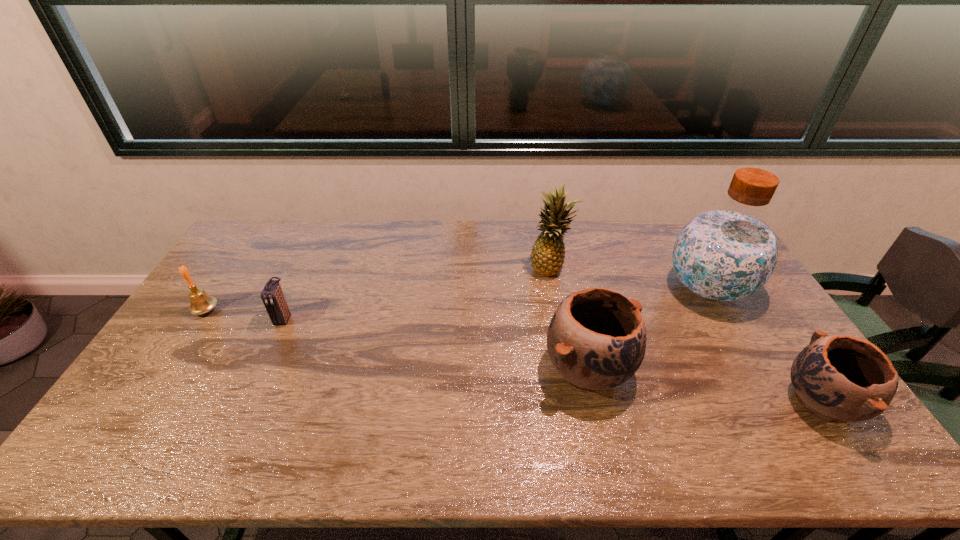
Please show where to add a pottery on the left while keeping spacing even. Please provide its 2D coordinates. Your answer should be formatted as a tuple, i.e. [(x, y)], where the tuple contains the x and y coordinates of a point satisfying the conditions above.

[(384, 340)]